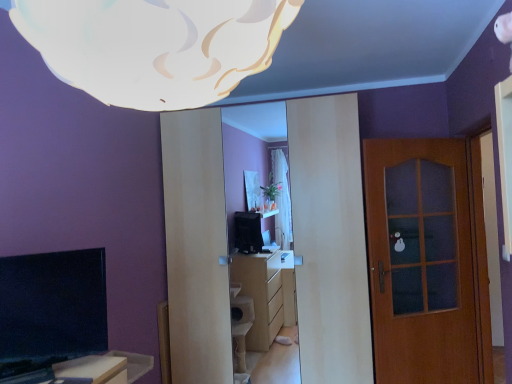
In order to face white matte cloud at upper center, should I rotate leftwards or rightwards?

Rotate your view left by about 12.696°.

Locate an element on the screen. white matte cloud at upper center is located at coordinates (154, 46).

This screenshot has height=384, width=512. Describe the element at coordinates (154, 46) in the screenshot. I see `white matte cloud at upper center` at that location.

Measure the distance between point (465, 375) and camera.

Point (465, 375) and camera are 10.17 feet apart.

Where is `brown wooden door at right`? Image resolution: width=512 pixels, height=384 pixels. brown wooden door at right is located at coordinates (426, 261).

This screenshot has height=384, width=512. Describe the element at coordinates (426, 261) in the screenshot. I see `brown wooden door at right` at that location.

Where is `white matte cloud at upper center`? Image resolution: width=512 pixels, height=384 pixels. white matte cloud at upper center is located at coordinates (154, 46).

Which is more to the left, white matte cloud at upper center or brown wooden door at right?

white matte cloud at upper center.

Which is in front, white matte cloud at upper center or brown wooden door at right?

white matte cloud at upper center is closer to the camera.

Does point (86, 68) come farther from viewer compared to point (413, 275)?

That is False.

From the image's perspective, would you say white matte cloud at upper center is positioned over brown wooden door at right?

Yes, from the image's perspective, white matte cloud at upper center is on top of brown wooden door at right.

From a real-world perspective, which object stands above the other?

white matte cloud at upper center.

Which object is wider, white matte cloud at upper center or brown wooden door at right?

white matte cloud at upper center.

Does white matte cloud at upper center have a greater height compared to brown wooden door at right?

In fact, white matte cloud at upper center may be shorter than brown wooden door at right.

In terms of size, does white matte cloud at upper center appear bigger or smaller than brown wooden door at right?

white matte cloud at upper center is smaller than brown wooden door at right.

Is white matte cloud at upper center not within brown wooden door at right?

Absolutely, white matte cloud at upper center is external to brown wooden door at right.

Is white matte cloud at upper center positioned far away from brown wooden door at right?

Absolutely, white matte cloud at upper center is distant from brown wooden door at right.

Could you tell me if white matte cloud at upper center is turned towards brown wooden door at right?

No, white matte cloud at upper center is not aimed at brown wooden door at right.

Can you tell me how much white matte cloud at upper center and brown wooden door at right differ in facing direction?

146 degrees.

How distant is white matte cloud at upper center from brown wooden door at right?

white matte cloud at upper center is 8.20 feet from brown wooden door at right.

Image resolution: width=512 pixels, height=384 pixels. I want to click on door located underneath the white matte cloud at upper center (from a real-world perspective), so click(x=426, y=261).

Between brown wooden door at right and white matte cloud at upper center, which one appears on the left side from the viewer's perspective?

From the viewer's perspective, white matte cloud at upper center appears more on the left side.

Which object is more forward, brown wooden door at right or white matte cloud at upper center?

white matte cloud at upper center is closer to the camera.

Between point (434, 217) and point (245, 68), which one is positioned in front?

The point (245, 68) is more forward.

From the image's perspective, which is below, brown wooden door at right or white matte cloud at upper center?

brown wooden door at right, from the image's perspective.

Based on the photo, from a real-world perspective, is brown wooden door at right over white matte cloud at upper center?

Incorrect, from a real-world perspective, brown wooden door at right is lower than white matte cloud at upper center.

Which of these two, brown wooden door at right or white matte cloud at upper center, is thinner?

brown wooden door at right is thinner.

Considering the sizes of objects brown wooden door at right and white matte cloud at upper center in the image provided, who is taller, brown wooden door at right or white matte cloud at upper center?

With more height is brown wooden door at right.

Considering the sizes of objects brown wooden door at right and white matte cloud at upper center in the image provided, who is smaller, brown wooden door at right or white matte cloud at upper center?

Smaller between the two is white matte cloud at upper center.

Is white matte cloud at upper center a part of brown wooden door at right?

Actually, white matte cloud at upper center is outside brown wooden door at right.

Is brown wooden door at right next to white matte cloud at upper center and touching it?

No, brown wooden door at right is not touching white matte cloud at upper center.

Is brown wooden door at right positioned with its back to white matte cloud at upper center?

No, brown wooden door at right is not facing away from white matte cloud at upper center.

What's the angular difference between brown wooden door at right and white matte cloud at upper center's facing directions?

146 degrees separate the facing orientations of brown wooden door at right and white matte cloud at upper center.

Locate an element on the screen. Image resolution: width=512 pixels, height=384 pixels. lamp above the brown wooden door at right (from the image's perspective) is located at coordinates (154, 46).

Identify the location of door behind the white matte cloud at upper center. This screenshot has width=512, height=384. (426, 261).

What are the coordinates of `door that is under the white matte cloud at upper center (from a real-world perspective)` in the screenshot? It's located at (426, 261).